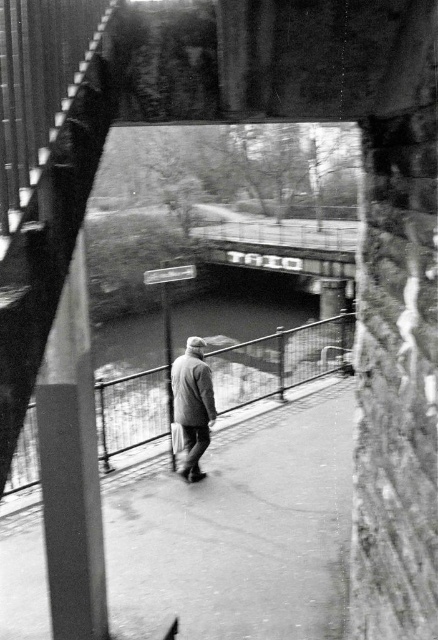
Question: Which point is closer to the camera taking this photo?

Choices:
 (A) (211, 368)
 (B) (303, 512)

Answer: (B)

Question: Does smooth concrete pavement at center appear on the right side of gray woolen jacket at center?

Choices:
 (A) yes
 (B) no

Answer: (A)

Question: From the image, what is the correct spatial relationship of smooth concrete pavement at center in relation to gray woolen jacket at center?

Choices:
 (A) left
 (B) right

Answer: (B)

Question: Is smooth metal rail at center wider than gray woolen jacket at center?

Choices:
 (A) no
 (B) yes

Answer: (B)

Question: Estimate the real-world distances between objects in this image. Which object is closer to the smooth metal rail at center?

Choices:
 (A) metallic sign at center
 (B) smooth concrete pavement at center

Answer: (B)

Question: Which object is the closest to the smooth concrete pavement at center?

Choices:
 (A) gray woolen jacket at center
 (B) metallic sign at center

Answer: (A)